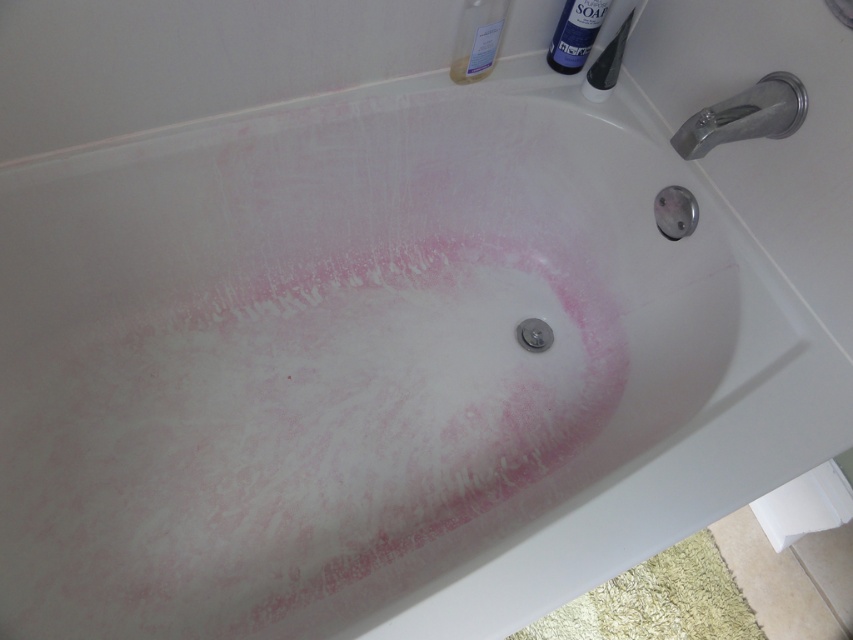
Between satin nickel faucet at upper right and blue plastic soap dispenser at upper right, which one has more height?

Standing taller between the two is satin nickel faucet at upper right.

Locate an element on the screen. satin nickel faucet at upper right is located at coordinates (746, 115).

Which of these two, clear plastic bottle at upper center or blue plastic soap dispenser at upper right, stands taller?

Standing taller between the two is clear plastic bottle at upper center.

Looking at this image, is clear plastic bottle at upper center taller than blue plastic soap dispenser at upper right?

Correct, clear plastic bottle at upper center is much taller as blue plastic soap dispenser at upper right.

Image resolution: width=853 pixels, height=640 pixels. Identify the location of clear plastic bottle at upper center. (477, 38).

Is satin nickel faucet at upper right positioned in front of clear plastic bottle at upper center?

Yes.

Is satin nickel faucet at upper right smaller than clear plastic bottle at upper center?

Incorrect, satin nickel faucet at upper right is not smaller in size than clear plastic bottle at upper center.

Which is behind, point (712, 145) or point (454, 58)?

The point (454, 58) is behind.

Locate an element on the screen. The height and width of the screenshot is (640, 853). satin nickel faucet at upper right is located at coordinates (746, 115).